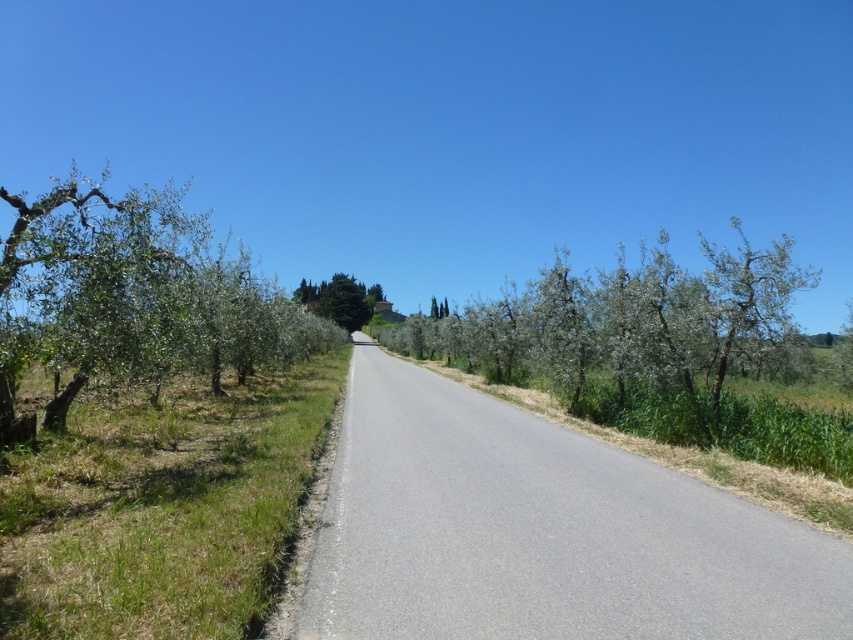
You are a hiker standing at the start of the road and want to know which tree is taller between the green leafy trees at center and the green leafy tree at center. Could you tell me which one is taller?

The green leafy trees at center is taller than the green leafy tree at center.

You are standing at the point marked by the coordinates point [132,300] in the image. Looking around, you see a green leafy tree at left. Which direction should you walk to reach the road?

The point [132,300] is marked at the green leafy tree at left. To reach the road, you should walk towards the right since the road is on the opposite side of the green leafy tree at left.